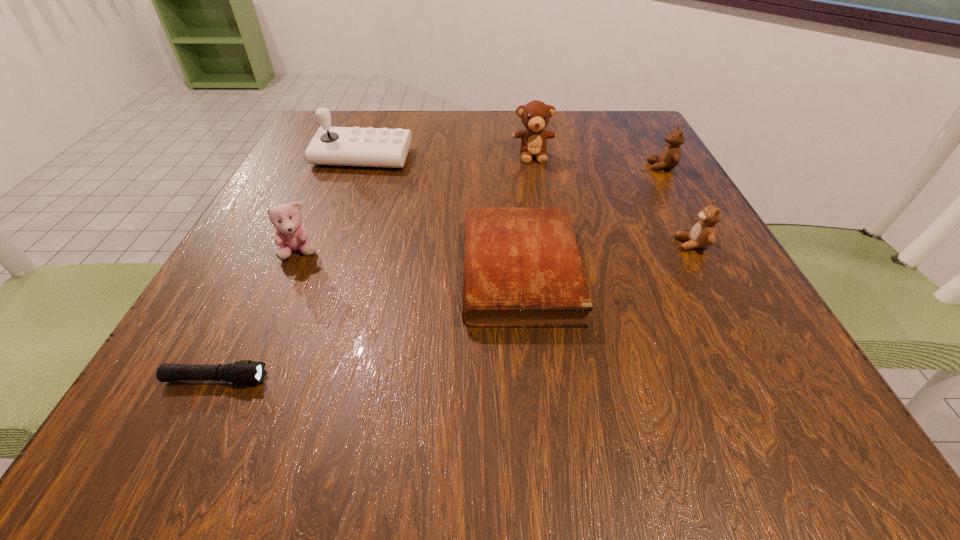
At what (x,y) coordinates should I click in order to perform the action: click on empty location between the leftmost teddy bear and the flashlight. Please return your answer as a coordinate pair (x, y). The image size is (960, 540). Looking at the image, I should click on (258, 316).

Identify the location of vacant region between the nearest object and the third teddy bear from right to left. (374, 267).

This screenshot has height=540, width=960. In order to click on the third closest object to the tallest teddy bear in this screenshot , I will do `click(335, 146)`.

Identify the location of object that ranks as the second closest to the tallest teddy bear. (522, 268).

Identify which teddy bear is the second nearest to the leftmost teddy bear. Please provide its 2D coordinates. Your answer should be formatted as a tuple, i.e. [(x, y)], where the tuple contains the x and y coordinates of a point satisfying the conditions above.

[(703, 234)]

Select which teddy bear appears as the fourth closest to the sixth tallest object. Please provide its 2D coordinates. Your answer should be formatted as a tuple, i.e. [(x, y)], where the tuple contains the x and y coordinates of a point satisfying the conditions above.

[(670, 156)]